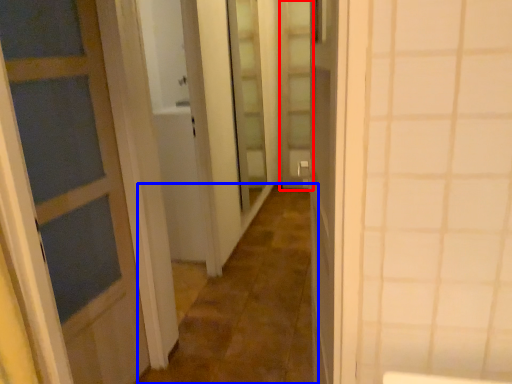
Question: Which object is closer to the camera taking this photo, screen door (highlighted by a red box) or alley (highlighted by a blue box)?

Choices:
 (A) screen door
 (B) alley

Answer: (B)